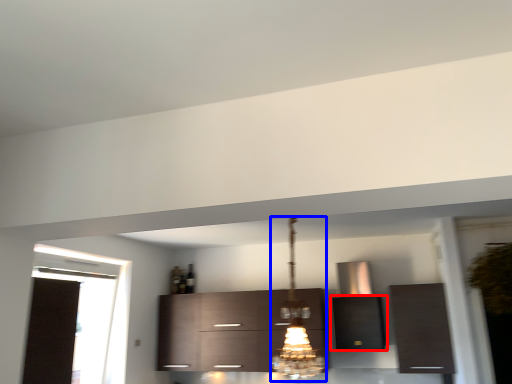
Question: Among these objects, which one is nearest to the camera, cabinetry (highlighted by a red box) or light fixture (highlighted by a blue box)?

Choices:
 (A) cabinetry
 (B) light fixture

Answer: (B)